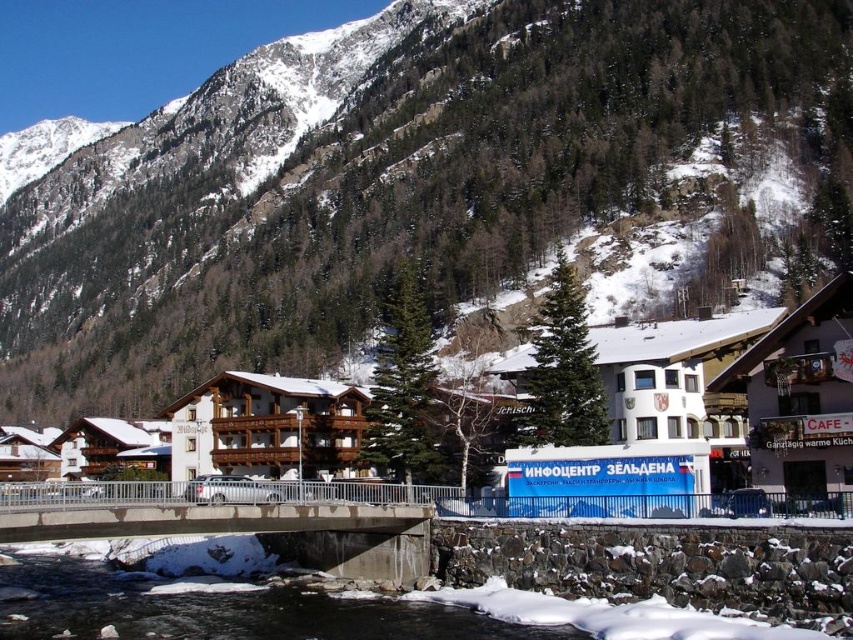
Consider the image. Can you confirm if concrete bridge at center is bigger than clear water at center?

No, concrete bridge at center is not bigger than clear water at center.

Can you confirm if concrete bridge at center is smaller than clear water at center?

Indeed, concrete bridge at center has a smaller size compared to clear water at center.

What do you see at coordinates (241, 520) in the screenshot?
I see `concrete bridge at center` at bounding box center [241, 520].

I want to click on concrete bridge at center, so click(241, 520).

Who is positioned more to the right, white wooden building at right or wooden cabin at center?

white wooden building at right is more to the right.

Is point (769, 468) more distant than point (233, 433)?

No, it is not.

Where is `white wooden building at right`? The width and height of the screenshot is (853, 640). white wooden building at right is located at coordinates (799, 397).

Is concrete bridge at center below white wooden building at right?

Yes.

Which is more to the left, concrete bridge at center or white wooden building at right?

From the viewer's perspective, concrete bridge at center appears more on the left side.

Which is behind, point (252, 493) or point (726, 388)?

Point (726, 388)

The image size is (853, 640). I want to click on concrete bridge at center, so click(241, 520).